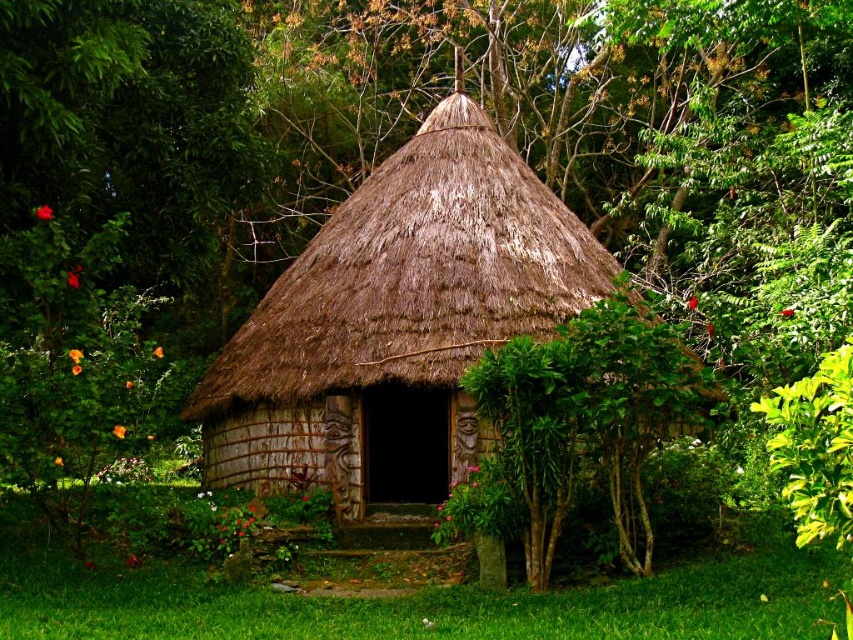
Between brown thatched hut at center and green leafy bush at center, which one has less height?

With less height is green leafy bush at center.

From the picture: Is brown thatched hut at center bigger than green leafy bush at center?

Yes.

Is point (454, 250) positioned behind point (608, 326)?

Yes, point (454, 250) is farther from viewer.

Where is `brown thatched hut at center`? The height and width of the screenshot is (640, 853). brown thatched hut at center is located at coordinates (396, 323).